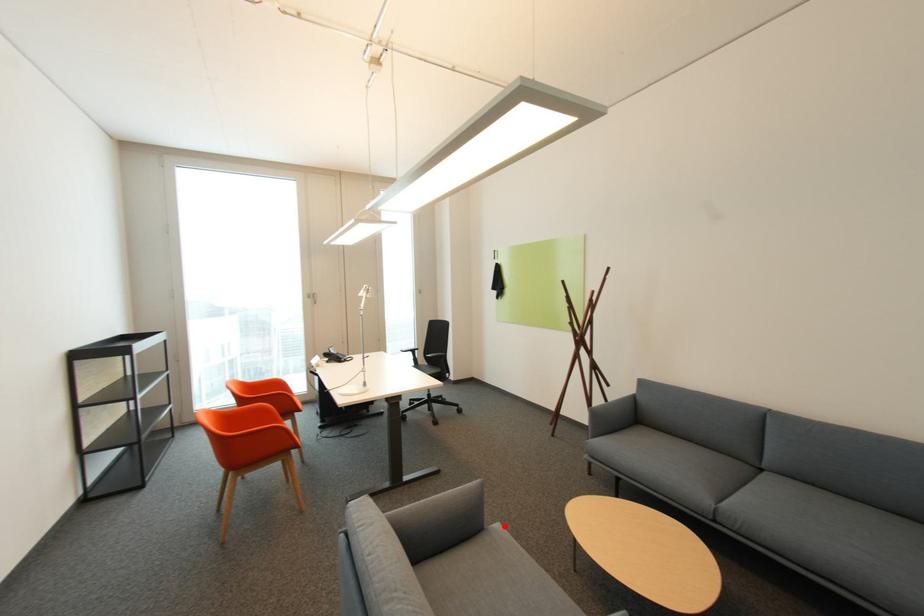
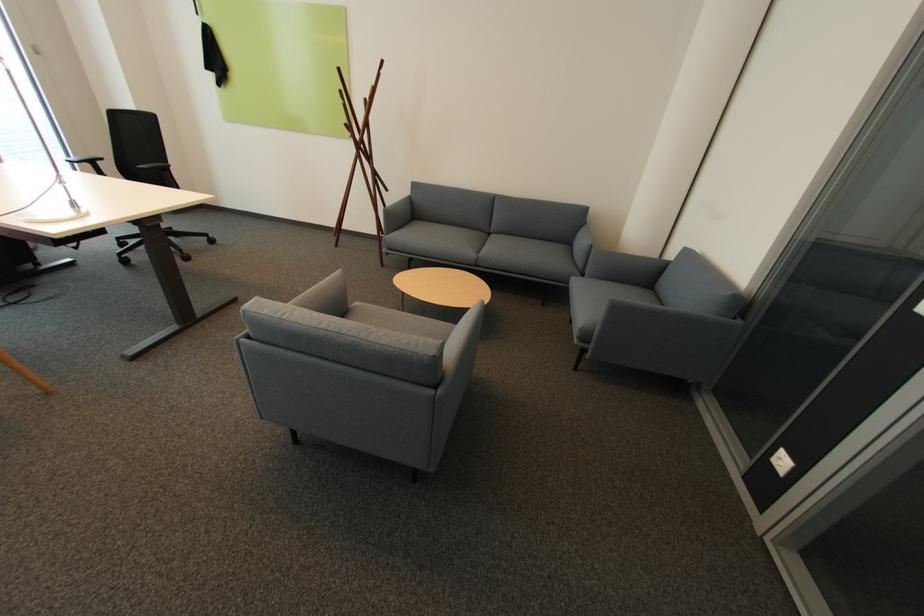
Where in the second image is the point corresponding to the highlighted location from the first image?

(362, 304)